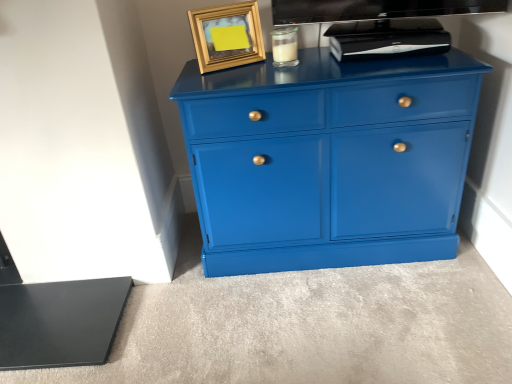
Locate an element on the screen. free space on the front side of glossy blue cabinet at center is located at coordinates (347, 317).